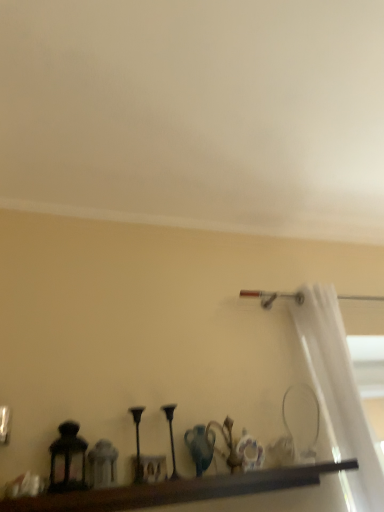
You are a GUI agent. You are given a task and a screenshot of the screen. Output one action in this format:
    pyautogui.click(x=<x>, y=<y>)
    Task: Click on the matte black lantern at left
    This screenshot has width=384, height=512.
    Given the screenshot: What is the action you would take?
    pyautogui.click(x=68, y=459)

Looking at their sizes, would you say brown wooden shelf at lower center is wider or thinner than matte black lantern at left?

Considering their sizes, brown wooden shelf at lower center looks broader than matte black lantern at left.

Is brown wooden shelf at lower center aimed at matte black lantern at left?

No, brown wooden shelf at lower center is not turned towards matte black lantern at left.

Is brown wooden shelf at lower center in front of or behind matte black lantern at left in the image?

In the image, brown wooden shelf at lower center appears in front of matte black lantern at left.

Can you confirm if matte black lantern at left is thinner than white sheer curtain at right?

Indeed, matte black lantern at left has a lesser width compared to white sheer curtain at right.

From a real-world perspective, who is located lower, matte black lantern at left or white sheer curtain at right?

matte black lantern at left.

Is matte black lantern at left facing towards white sheer curtain at right?

No, matte black lantern at left is not oriented towards white sheer curtain at right.

Is white sheer curtain at right positioned with its back to brown wooden shelf at lower center?

No, brown wooden shelf at lower center is not at the back of white sheer curtain at right.

In terms of width, does white sheer curtain at right look wider or thinner when compared to brown wooden shelf at lower center?

white sheer curtain at right is wider than brown wooden shelf at lower center.

Is white sheer curtain at right positioned beyond the bounds of brown wooden shelf at lower center?

Yes, white sheer curtain at right is outside of brown wooden shelf at lower center.

Can you see white sheer curtain at right touching brown wooden shelf at lower center?

No, white sheer curtain at right is not next to brown wooden shelf at lower center.

This screenshot has width=384, height=512. I want to click on shelf below the white sheer curtain at right (from a real-world perspective), so click(178, 490).

Would you say brown wooden shelf at lower center is a long distance from white sheer curtain at right?

Actually, brown wooden shelf at lower center and white sheer curtain at right are a little close together.

Is point (274, 488) positioned before point (352, 452)?

Yes, it is.

Which is less distant, (73,442) or (262,488)?

Point (73,442).

Which object is more forward, matte black lantern at left or brown wooden shelf at lower center?

brown wooden shelf at lower center is closer to the camera.

Is matte black lantern at left next to brown wooden shelf at lower center?

matte black lantern at left and brown wooden shelf at lower center are clearly separated.

From a real-world perspective, who is located lower, matte black lantern at left or brown wooden shelf at lower center?

brown wooden shelf at lower center.

From the image's perspective, which is above, white sheer curtain at right or matte black lantern at left?

white sheer curtain at right.

Is white sheer curtain at right inside or outside of matte black lantern at left?

white sheer curtain at right lies outside matte black lantern at left.

Is white sheer curtain at right taller than matte black lantern at left?

Correct, white sheer curtain at right is much taller as matte black lantern at left.

Is white sheer curtain at right to the right of matte black lantern at left from the viewer's perspective?

Correct, you'll find white sheer curtain at right to the right of matte black lantern at left.

The height and width of the screenshot is (512, 384). I want to click on shelf beneath the matte black lantern at left (from a real-world perspective), so (x=178, y=490).

At what (x,y) coordinates should I click in order to perform the action: click on candle holder that is below the white sheer curtain at right (from the image's perspective). Please return your answer as a coordinate pair (x, y). Looking at the image, I should click on (68, 459).

Looking at this image, when comparing their distances from matte black lantern at left, does brown wooden shelf at lower center or white sheer curtain at right seem closer?

brown wooden shelf at lower center lies closer to matte black lantern at left than the other object.

Based on their spatial positions, is white sheer curtain at right or brown wooden shelf at lower center closer to matte black lantern at left?

brown wooden shelf at lower center.

Considering their positions, is matte black lantern at left positioned closer to brown wooden shelf at lower center than white sheer curtain at right?

matte black lantern at left is closer to brown wooden shelf at lower center.

When comparing their distances from brown wooden shelf at lower center, does white sheer curtain at right or matte black lantern at left seem further?

white sheer curtain at right.

Looking at the image, which one is located further to white sheer curtain at right, brown wooden shelf at lower center or matte black lantern at left?

Based on the image, matte black lantern at left appears to be further to white sheer curtain at right.

Which object lies nearer to the anchor point white sheer curtain at right, matte black lantern at left or brown wooden shelf at lower center?

Among the two, brown wooden shelf at lower center is located nearer to white sheer curtain at right.

Locate an element on the screen. The image size is (384, 512). shelf located between matte black lantern at left and white sheer curtain at right in the left-right direction is located at coordinates (178, 490).